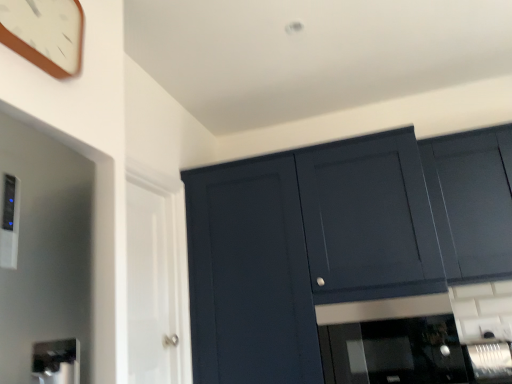
Question: Looking at their shapes, would you say wooden clock at upper left is wider or thinner than matte dark blue cabinet at upper right?

Choices:
 (A) thin
 (B) wide

Answer: (A)

Question: From a real-world perspective, is wooden clock at upper left physically located above or below matte dark blue cabinet at upper right?

Choices:
 (A) below
 (B) above

Answer: (B)

Question: Estimate the real-world distances between objects in this image. Which object is closer to the white glossy door at left?

Choices:
 (A) black glass microwave at center, acting as the 1th appliance starting from the left
 (B) matte dark blue cabinet at upper right
 (C) satin silver appliance at lower right, which appears as the second appliance when viewed from the left
 (D) wooden clock at upper left
 (E) matte dark blue cabinet at upper right

Answer: (B)

Question: Which of these objects is positioned closest to the wooden clock at upper left?

Choices:
 (A) matte dark blue cabinet at upper right
 (B) black glass microwave at center, marked as the 2th appliance in a right-to-left arrangement
 (C) satin silver appliance at lower right, which appears as the second appliance when viewed from the left
 (D) white glossy door at left
 (E) matte dark blue cabinet at upper right

Answer: (D)